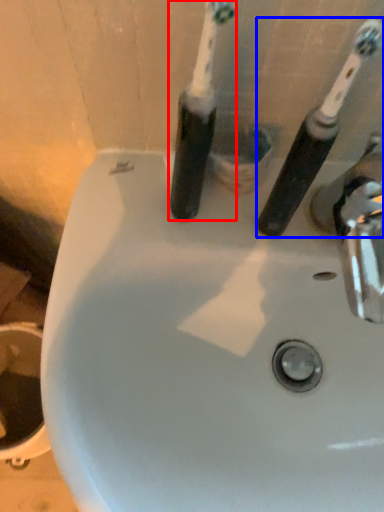
Question: Which of the following is the closest to the observer, toothbrush (highlighted by a red box) or toothbrush (highlighted by a blue box)?

Choices:
 (A) toothbrush
 (B) toothbrush

Answer: (A)